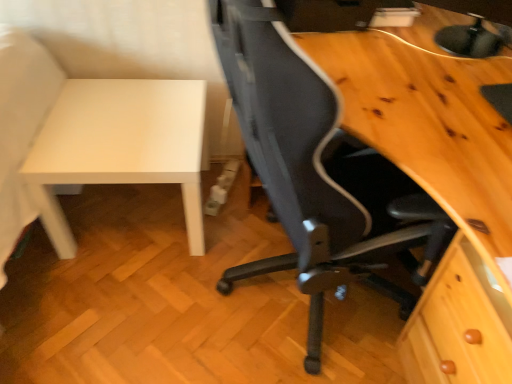
Question: Should I look upward or downward to see white matte table at left?

Choices:
 (A) up
 (B) down

Answer: (A)

Question: Is matte black monitor at upper right to the right of black mesh chair at center from the viewer's perspective?

Choices:
 (A) yes
 (B) no

Answer: (A)

Question: From the image's perspective, is matte black monitor at upper right beneath black mesh chair at center?

Choices:
 (A) no
 (B) yes

Answer: (A)

Question: Can you confirm if matte black monitor at upper right is smaller than black mesh chair at center?

Choices:
 (A) no
 (B) yes

Answer: (B)

Question: Does matte black monitor at upper right turn towards black mesh chair at center?

Choices:
 (A) no
 (B) yes

Answer: (A)

Question: Is matte black monitor at upper right in front of black mesh chair at center?

Choices:
 (A) yes
 (B) no

Answer: (B)

Question: From the image's perspective, would you say matte black monitor at upper right is positioned over black mesh chair at center?

Choices:
 (A) yes
 (B) no

Answer: (A)

Question: Does white matte table at left appear on the left side of black mesh chair at center?

Choices:
 (A) no
 (B) yes

Answer: (B)

Question: Considering the relative positions of white matte table at left and black mesh chair at center in the image provided, is white matte table at left in front of black mesh chair at center?

Choices:
 (A) no
 (B) yes

Answer: (A)

Question: Is white matte table at left thinner than black mesh chair at center?

Choices:
 (A) no
 (B) yes

Answer: (B)

Question: Is white matte table at left positioned behind black mesh chair at center?

Choices:
 (A) no
 (B) yes

Answer: (B)

Question: Is white matte table at left at the right side of black mesh chair at center?

Choices:
 (A) yes
 (B) no

Answer: (B)

Question: Is white matte table at left next to black mesh chair at center?

Choices:
 (A) no
 (B) yes

Answer: (A)

Question: Considering the relative sizes of white matte table at left and matte black monitor at upper right in the image provided, is white matte table at left shorter than matte black monitor at upper right?

Choices:
 (A) yes
 (B) no

Answer: (B)